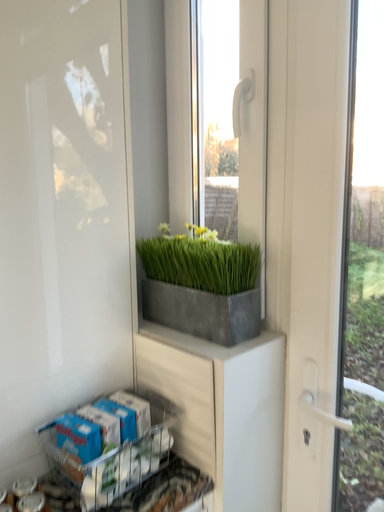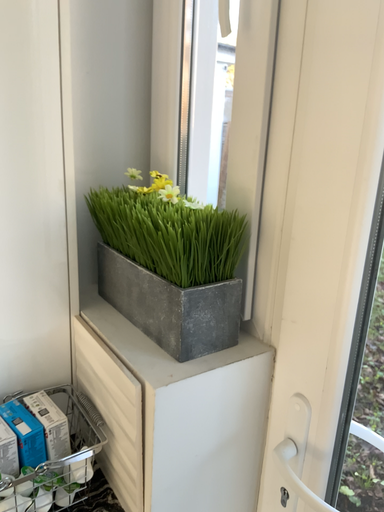
Question: Which way did the camera rotate in the video?

Choices:
 (A) rotated downward
 (B) rotated upward

Answer: (A)